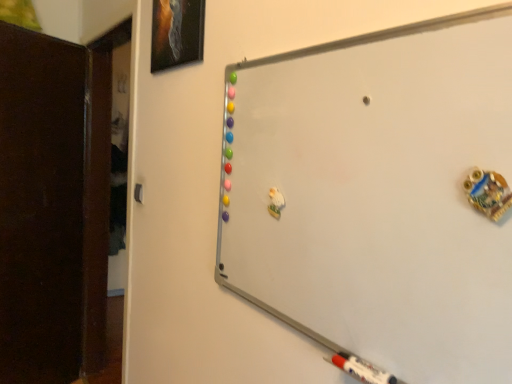
Question: Is matte black picture frame at upper left aimed at whiteboard at upper right?

Choices:
 (A) no
 (B) yes

Answer: (A)

Question: Is matte black picture frame at upper left beside whiteboard at upper right?

Choices:
 (A) yes
 (B) no

Answer: (B)

Question: Can you confirm if matte black picture frame at upper left is positioned to the left of whiteboard at upper right?

Choices:
 (A) no
 (B) yes

Answer: (B)

Question: From a real-world perspective, is matte black picture frame at upper left located beneath whiteboard at upper right?

Choices:
 (A) no
 (B) yes

Answer: (A)

Question: From the image's perspective, is matte black picture frame at upper left under whiteboard at upper right?

Choices:
 (A) yes
 (B) no

Answer: (B)

Question: Can you confirm if matte black picture frame at upper left is shorter than whiteboard at upper right?

Choices:
 (A) yes
 (B) no

Answer: (A)

Question: From a real-world perspective, is matte black picture frame at upper left below dark wood door at left?

Choices:
 (A) yes
 (B) no

Answer: (B)

Question: Is the depth of matte black picture frame at upper left greater than that of dark wood door at left?

Choices:
 (A) no
 (B) yes

Answer: (A)

Question: Can you confirm if matte black picture frame at upper left is wider than dark wood door at left?

Choices:
 (A) no
 (B) yes

Answer: (A)

Question: Is matte black picture frame at upper left facing towards dark wood door at left?

Choices:
 (A) yes
 (B) no

Answer: (B)

Question: Can you confirm if matte black picture frame at upper left is bigger than dark wood door at left?

Choices:
 (A) yes
 (B) no

Answer: (B)

Question: From the image's perspective, is matte black picture frame at upper left located above dark wood door at left?

Choices:
 (A) no
 (B) yes

Answer: (B)

Question: Considering the relative positions of dark wood door at left and matte black picture frame at upper left in the image provided, is dark wood door at left to the left of matte black picture frame at upper left from the viewer's perspective?

Choices:
 (A) no
 (B) yes

Answer: (B)